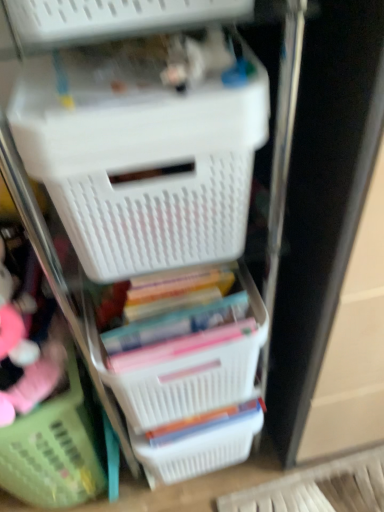
Question: Would you say white plastic basket at lower center, the first basket positioned from the right, is outside white plastic basket at center, which is the second basket in right-to-left order?

Choices:
 (A) yes
 (B) no

Answer: (A)

Question: Is white plastic basket at lower center, the first basket positioned from the right, beside white plastic basket at center, placed as the second basket when sorted from left to right?

Choices:
 (A) no
 (B) yes

Answer: (A)

Question: Is white plastic basket at lower center, the first basket positioned from the right, shorter than white plastic basket at center, placed as the second basket when sorted from left to right?

Choices:
 (A) no
 (B) yes

Answer: (A)

Question: Is white plastic basket at lower center, the first basket positioned from the right, oriented towards white plastic basket at center, placed as the second basket when sorted from left to right?

Choices:
 (A) no
 (B) yes

Answer: (A)

Question: From a real-world perspective, is white plastic basket at lower center, the first basket positioned from the right, below white plastic basket at center, placed as the second basket when sorted from left to right?

Choices:
 (A) no
 (B) yes

Answer: (B)

Question: From a real-world perspective, is white plastic basket at center, which is the second basket in right-to-left order, positioned above or below green plastic basket at lower left, the 1th basket from the left?

Choices:
 (A) above
 (B) below

Answer: (A)

Question: Is point (190, 376) closer or farther from the camera than point (69, 416)?

Choices:
 (A) closer
 (B) farther

Answer: (A)

Question: From the image's perspective, is white plastic basket at center, placed as the second basket when sorted from left to right, located above or below green plastic basket at lower left, the 1th basket from the left?

Choices:
 (A) below
 (B) above

Answer: (B)

Question: Is white plastic basket at center, which is the second basket in right-to-left order, wider or thinner than green plastic basket at lower left, the 3th basket when ordered from right to left?

Choices:
 (A) thin
 (B) wide

Answer: (A)

Question: Considering the positions of white plastic basket at upper center and white plastic basket at lower center, the first basket positioned from the right, in the image, is white plastic basket at upper center wider or thinner than white plastic basket at lower center, the first basket positioned from the right,?

Choices:
 (A) wide
 (B) thin

Answer: (A)

Question: In terms of height, does white plastic basket at upper center look taller or shorter compared to white plastic basket at lower center, which is the 3th basket from left to right?

Choices:
 (A) short
 (B) tall

Answer: (B)

Question: From a real-world perspective, is white plastic basket at upper center positioned above or below white plastic basket at lower center, which is the 3th basket from left to right?

Choices:
 (A) below
 (B) above

Answer: (B)

Question: From the image's perspective, is white plastic basket at upper center above or below white plastic basket at lower center, the first basket positioned from the right?

Choices:
 (A) above
 (B) below

Answer: (A)

Question: Is white plastic basket at center, placed as the second basket when sorted from left to right, inside the boundaries of white plastic basket at upper center, or outside?

Choices:
 (A) outside
 (B) inside

Answer: (A)

Question: From their relative heights in the image, would you say white plastic basket at center, which is the second basket in right-to-left order, is taller or shorter than white plastic basket at upper center?

Choices:
 (A) short
 (B) tall

Answer: (A)